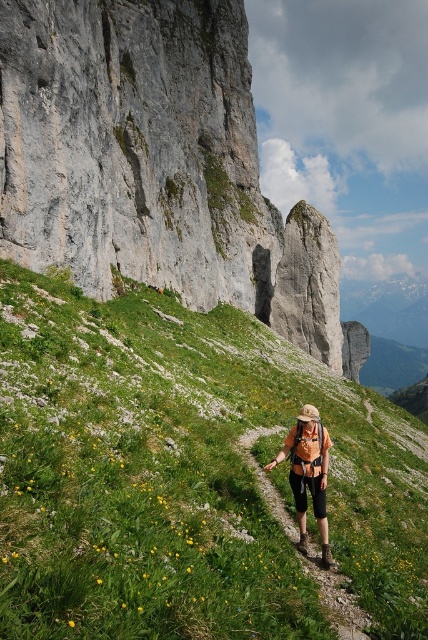
Between gray rock formation at upper center and orange fabric backpack at center, which one is positioned lower?

Positioned lower is orange fabric backpack at center.

Is gray rock formation at upper center wider than orange fabric backpack at center?

Indeed, gray rock formation at upper center has a greater width compared to orange fabric backpack at center.

This screenshot has width=428, height=640. Find the location of `gray rock formation at upper center`. gray rock formation at upper center is located at coordinates (154, 163).

Where is `gray rock formation at upper center`? gray rock formation at upper center is located at coordinates pyautogui.click(x=154, y=163).

Who is higher up, green grassy at center or gray rock formation at upper center?

gray rock formation at upper center is above.

Is green grassy at center wider than gray rock formation at upper center?

Incorrect, green grassy at center's width does not surpass gray rock formation at upper center's.

Who is more distant from viewer, (228,589) or (18,189)?

The point (18,189) is more distant.

Identify the location of green grassy at center. The width and height of the screenshot is (428, 640). (186, 476).

Does green grassy at center have a larger size compared to orange fabric backpack at center?

Yes.

Between point (143, 380) and point (264, 435), which one is positioned in front?

Positioned in front is point (143, 380).

Identify the location of green grassy at center. This screenshot has width=428, height=640. (186, 476).